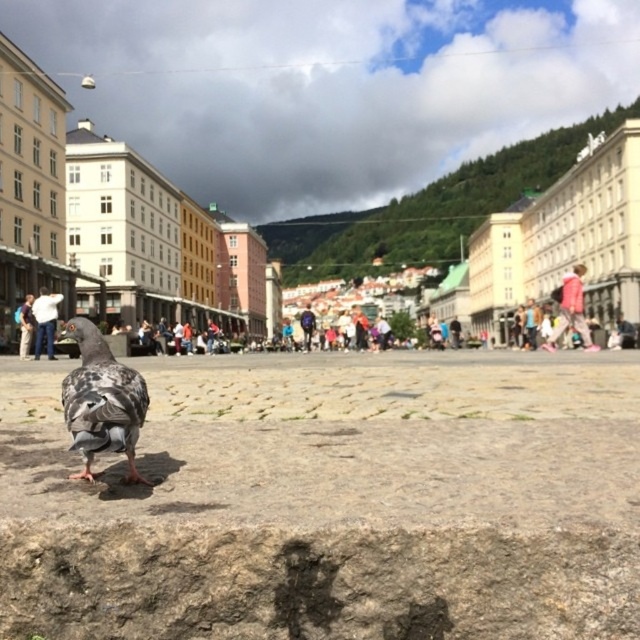
Can you confirm if gray matte pigeon at lower left is taller than pink fabric at upper right?

In fact, gray matte pigeon at lower left may be shorter than pink fabric at upper right.

Which is more to the left, gray matte pigeon at lower left or pink fabric at upper right?

gray matte pigeon at lower left

Is point (99, 412) behind point (547, 342)?

No, it is in front of (547, 342).

Find the location of a particular element. The height and width of the screenshot is (640, 640). gray matte pigeon at lower left is located at coordinates [100, 401].

You are a GUI agent. You are given a task and a screenshot of the screen. Output one action in this format:
    pyautogui.click(x=<x>, y=<y>)
    Task: Click on the gray matte pigeon at lower left
    
    Given the screenshot: What is the action you would take?
    pyautogui.click(x=100, y=401)

This screenshot has width=640, height=640. What are the coordinates of `gray matte pigeon at lower left` in the screenshot? It's located at (100, 401).

Which is above, white cotton shirt at center or dark blue jeans at center?

white cotton shirt at center is above.

Does point (44, 305) come closer to viewer compared to point (28, 348)?

Yes, point (44, 305) is in front of point (28, 348).

Describe the element at coordinates (45, 321) in the screenshot. I see `white cotton shirt at center` at that location.

Image resolution: width=640 pixels, height=640 pixels. I want to click on white cotton shirt at center, so click(x=45, y=321).